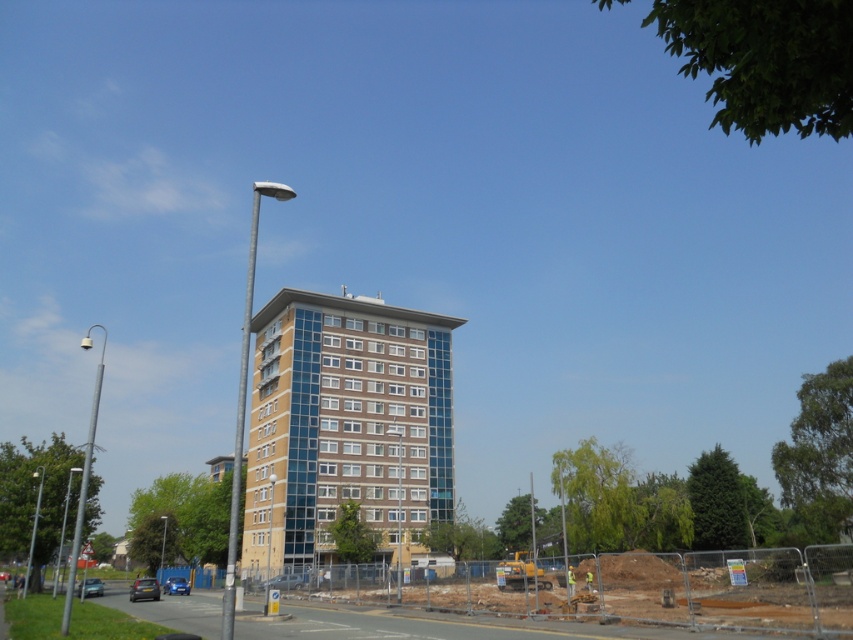
Question: Does brown glass building at center appear over brown earth at lower center?

Choices:
 (A) yes
 (B) no

Answer: (A)

Question: Observing the image, what is the correct spatial positioning of brown glass building at center in reference to brown earth at lower center?

Choices:
 (A) left
 (B) right

Answer: (A)

Question: Can you confirm if brown glass building at center is smaller than brown earth at lower center?

Choices:
 (A) no
 (B) yes

Answer: (B)

Question: Among these objects, which one is farthest from the camera?

Choices:
 (A) brown earth at lower center
 (B) brown glass building at center

Answer: (B)